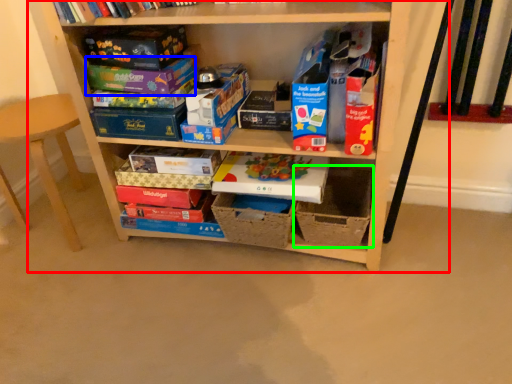
Question: Considering the real-world distances, which object is closest to shelf (highlighted by a red box)? paperback book (highlighted by a blue box) or cardboard box (highlighted by a green box).

Choices:
 (A) paperback book
 (B) cardboard box

Answer: (B)